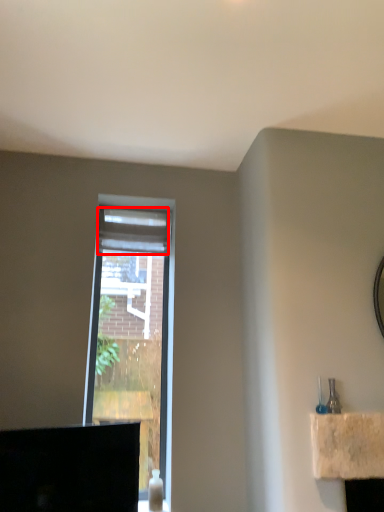
Question: From the image, what is the correct spatial relationship of curtain (annotated by the red box) in relation to window?

Choices:
 (A) right
 (B) left

Answer: (A)